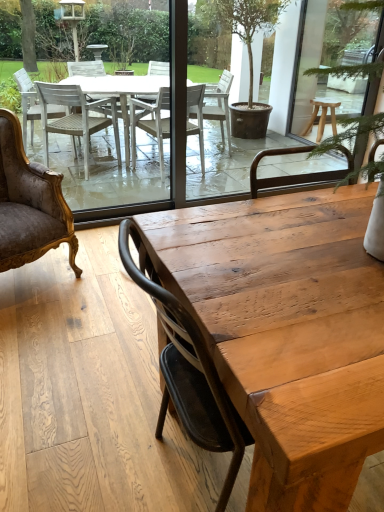
Question: From the image's perspective, is natural wood table at center above or below velvet gold armchair at left?

Choices:
 (A) below
 (B) above

Answer: (A)

Question: Is natural wood table at center in front of or behind velvet gold armchair at left in the image?

Choices:
 (A) front
 (B) behind

Answer: (A)

Question: Visually, is natural wood table at center positioned to the left or to the right of velvet gold armchair at left?

Choices:
 (A) right
 (B) left

Answer: (A)

Question: In terms of size, does velvet gold armchair at left appear bigger or smaller than natural wood table at center?

Choices:
 (A) big
 (B) small

Answer: (B)

Question: From the image's perspective, is velvet gold armchair at left positioned above or below natural wood table at center?

Choices:
 (A) below
 (B) above

Answer: (B)

Question: Does point (39, 173) appear closer or farther from the camera than point (218, 226)?

Choices:
 (A) farther
 (B) closer

Answer: (A)

Question: Considering the positions of velvet gold armchair at left and natural wood table at center in the image, is velvet gold armchair at left taller or shorter than natural wood table at center?

Choices:
 (A) tall
 (B) short

Answer: (A)